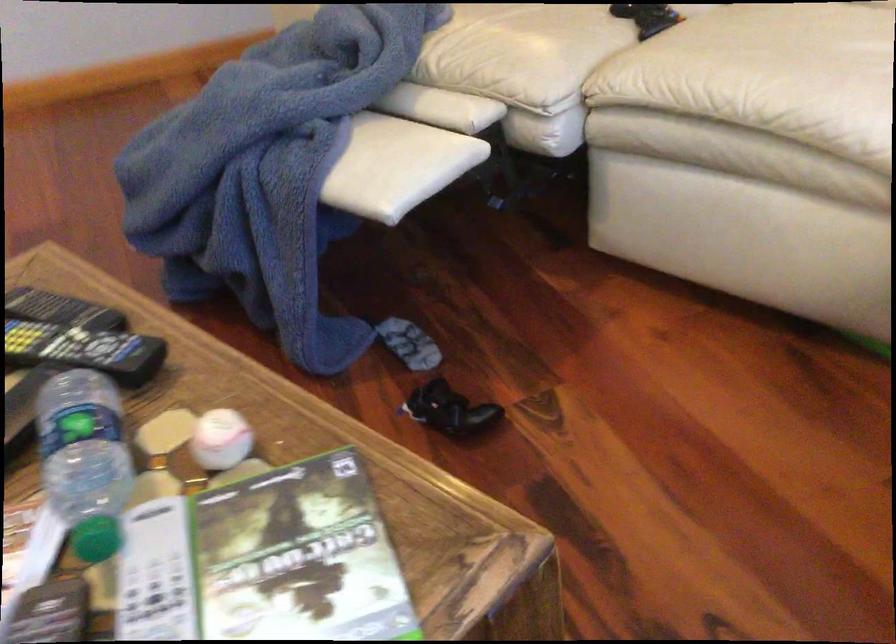
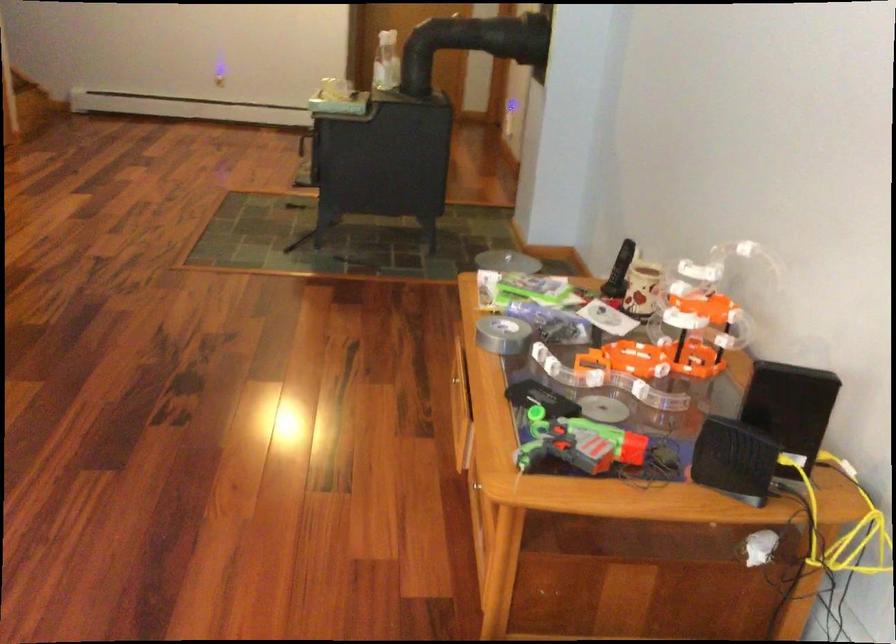
Question: Which direction would the cameraman need to move to produce the second image? Reply with the corresponding letter.

Choices:
 (A) Left
 (B) Right
 (C) Forward
 (D) Backward

Answer: (B)